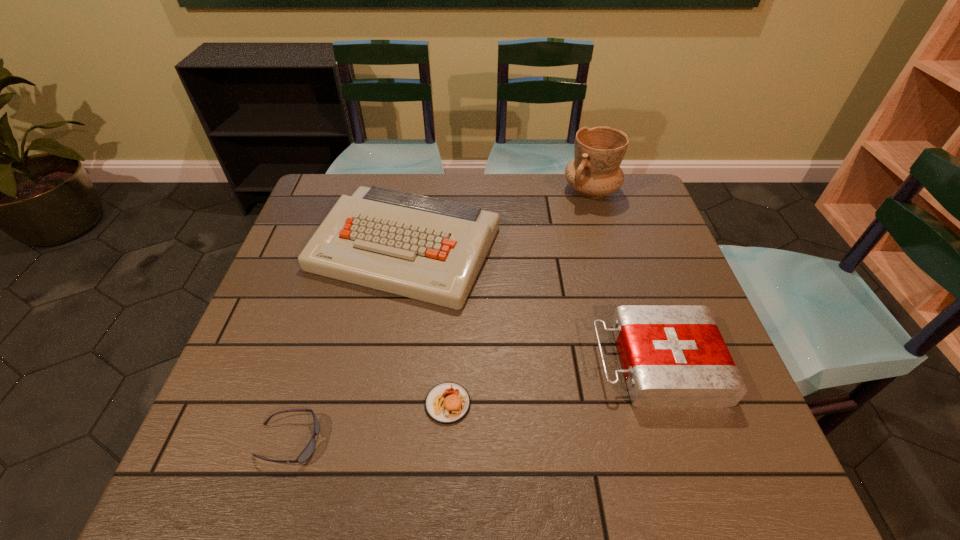
You are a GUI agent. You are given a task and a screenshot of the screen. Output one action in this format:
    pyautogui.click(x=<x>, y=<y>)
    Task: Click on the free point located 0.400m on the back of the second shortest object
    
    Given the screenshot: What is the action you would take?
    pyautogui.click(x=456, y=254)

Where is `vacant space located on the lenses of the shortest object`? This screenshot has height=540, width=960. vacant space located on the lenses of the shortest object is located at coordinates (434, 441).

Identify the location of pottery present at the far edge. This screenshot has height=540, width=960. (595, 171).

Identify the location of computer keyboard present at the far edge. (429, 249).

This screenshot has width=960, height=540. Identify the location of object situated at the near edge. pyautogui.click(x=308, y=451).

You are a GUI agent. You are given a task and a screenshot of the screen. Output one action in this format:
    pyautogui.click(x=<x>, y=<y>)
    Task: Click on the computer keyboard that is at the left edge
    
    Given the screenshot: What is the action you would take?
    pyautogui.click(x=429, y=249)

The height and width of the screenshot is (540, 960). In order to click on sunglasses that is at the left edge in this screenshot , I will do `click(308, 451)`.

At what (x,y) coordinates should I click in order to perform the action: click on pottery located in the right edge section of the desktop. Please return your answer as a coordinate pair (x, y). This screenshot has width=960, height=540. Looking at the image, I should click on (595, 171).

You are a GUI agent. You are given a task and a screenshot of the screen. Output one action in this format:
    pyautogui.click(x=<x>, y=<y>)
    Task: Click on the first-aid kit at the right edge
    Image resolution: width=960 pixels, height=540 pixels.
    Given the screenshot: What is the action you would take?
    pyautogui.click(x=673, y=356)

Image resolution: width=960 pixels, height=540 pixels. What are the coordinates of `object positioned at the far left corner` in the screenshot? It's located at (429, 249).